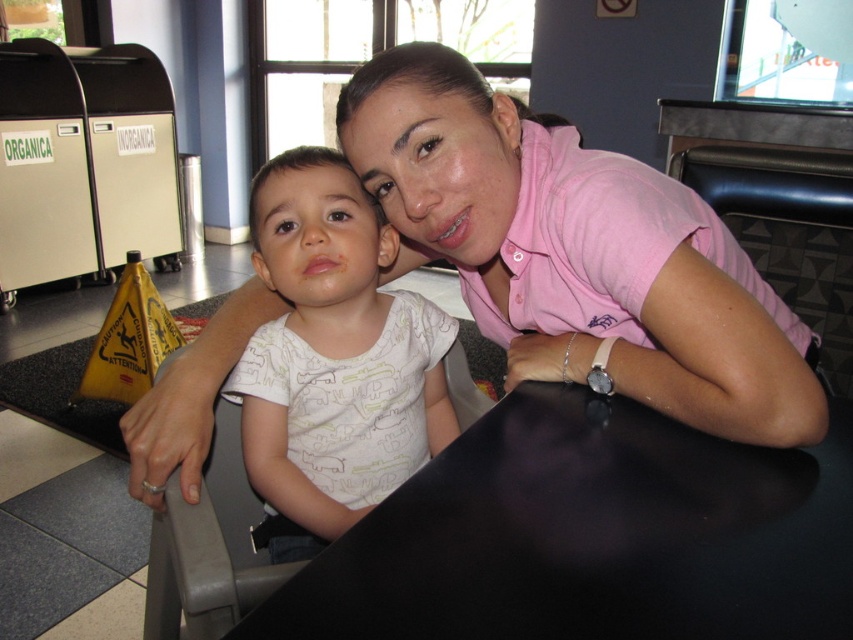
You are a photographer taking a picture of the pink cotton shirt at center and the white printed shirt at center. Which shirt should you focus on first if you want to capture both in the same frame without moving the camera?

The pink cotton shirt at center should be focused on first because it is above the white printed shirt at center, so adjusting focus upwards will ensure both are in the frame.

Consider the image. You are a service robot in a public dining area. You need to move from your current position to the trash bin labeled ORGANICA. There are two points marked in the scene. The first point is at coordinate point(x=712, y=348) and the second is at point(x=282, y=500). Which point should you navigate through to reach the ORGANICA trash bin efficiently?

Point(x=712, y=348) is in front of point(x=282, y=500), so you should navigate through point(x=712, y=348) first to reach the ORGANICA trash bin efficiently.